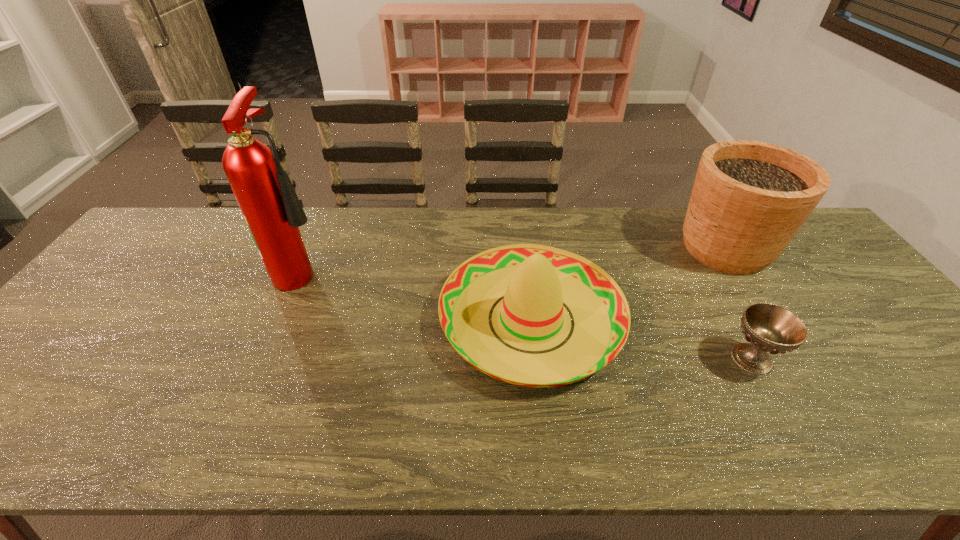
Identify the location of fire extinguisher that is positioned at the far edge. (270, 206).

You are a GUI agent. You are given a task and a screenshot of the screen. Output one action in this format:
    pyautogui.click(x=<x>, y=<y>)
    Task: Click on the flowerpot present at the far edge
    
    Given the screenshot: What is the action you would take?
    pyautogui.click(x=749, y=199)

Find the location of a particular element. This screenshot has height=540, width=960. object present at the right edge is located at coordinates (749, 199).

The height and width of the screenshot is (540, 960). I want to click on object located at the far right corner, so click(x=749, y=199).

At what (x,y) coordinates should I click in order to perform the action: click on free point at the far edge. Please return your answer as a coordinate pair (x, y). This screenshot has height=540, width=960. Looking at the image, I should click on click(x=623, y=227).

You are a GUI agent. You are given a task and a screenshot of the screen. Output one action in this format:
    pyautogui.click(x=<x>, y=<y>)
    Task: Click on the vacant area at the near edge of the desktop
    The height and width of the screenshot is (540, 960).
    Given the screenshot: What is the action you would take?
    pyautogui.click(x=630, y=439)

Image resolution: width=960 pixels, height=540 pixels. In the image, there is a desktop. Identify the location of free space at the right edge. (851, 310).

You are a GUI agent. You are given a task and a screenshot of the screen. Output one action in this format:
    pyautogui.click(x=<x>, y=<y>)
    Task: Click on the empty space between the second tallest object and the chalice
    
    Given the screenshot: What is the action you would take?
    pyautogui.click(x=739, y=303)

This screenshot has height=540, width=960. In order to click on free spot between the third object from right to left and the chalice in this screenshot , I will do `click(641, 339)`.

I want to click on free space between the chalice and the second tallest object, so click(739, 303).